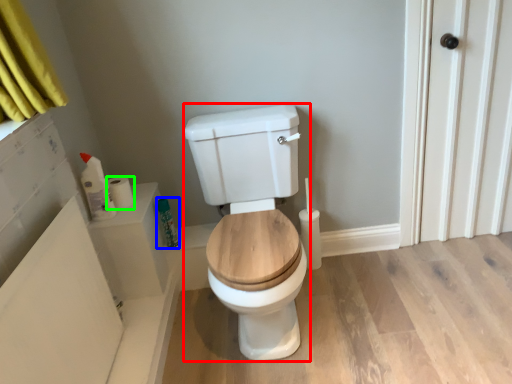
Question: Which is farther away from porcelain (highlighted by a red box)? toiletry (highlighted by a blue box) or toilet paper (highlighted by a green box)?

Choices:
 (A) toiletry
 (B) toilet paper

Answer: (B)